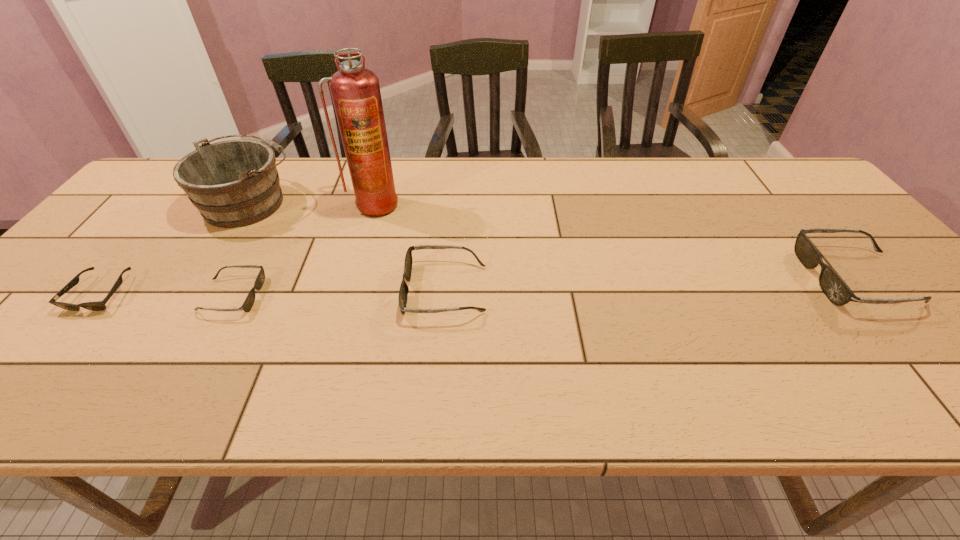
Where is `free space located 0.270m on the front-facing side of the fourth tallest object`? This screenshot has width=960, height=540. free space located 0.270m on the front-facing side of the fourth tallest object is located at coordinates (290, 289).

Locate an element on the screen. The height and width of the screenshot is (540, 960). vacant position located on the front-facing side of the fourth tallest object is located at coordinates (379, 289).

Find the location of `vacant region located 0.210m on the front-facing side of the rightmost sunglasses`. vacant region located 0.210m on the front-facing side of the rightmost sunglasses is located at coordinates (722, 278).

Identify the location of vacant area situated on the front-facing side of the rightmost sunglasses. (768, 278).

This screenshot has width=960, height=540. What are the coordinates of `vacant space located 0.280m on the front-facing side of the rightmost sunglasses` in the screenshot? It's located at (693, 278).

Where is `free location located 0.210m on the side of the third object from right to left with the label`? free location located 0.210m on the side of the third object from right to left with the label is located at coordinates (355, 271).

Find the location of a particular element. The image size is (960, 540). blank space located on the front of the wine bucket is located at coordinates (162, 341).

At what (x,y) coordinates should I click in order to perform the action: click on vacant region located on the front-facing side of the leftmost object. Please return your answer as a coordinate pair (x, y). The height and width of the screenshot is (540, 960). Looking at the image, I should click on (62, 340).

At what (x,y) coordinates should I click in order to perform the action: click on fire extinguisher positioned at the far edge. Please return your answer as a coordinate pair (x, y). Looking at the image, I should click on (355, 90).

The width and height of the screenshot is (960, 540). I want to click on wine bucket at the far edge, so click(234, 183).